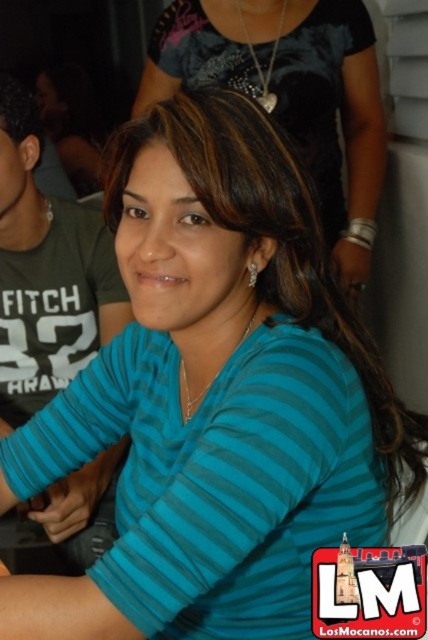
Can you confirm if blue striped shirt at center is thinner than green cotton shirt at left?

No.

Between point (243, 65) and point (68, 289), which one is positioned behind?

The point (243, 65) is behind.

Find the location of a particular element. This screenshot has width=428, height=640. blue striped shirt at center is located at coordinates point(291,93).